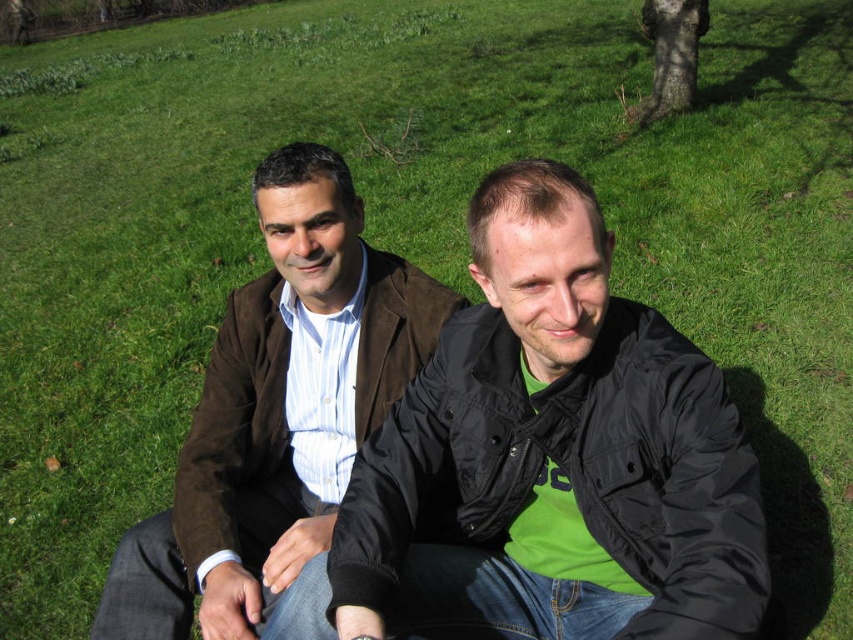
Who is more forward, (688, 412) or (259, 608)?

Point (688, 412) is more forward.

What do you see at coordinates (561, 445) in the screenshot? I see `matte black jacket at center` at bounding box center [561, 445].

Between point (680, 602) and point (194, 456), which one is positioned in front?

Point (680, 602)

What are the coordinates of `matte black jacket at center` in the screenshot? It's located at (561, 445).